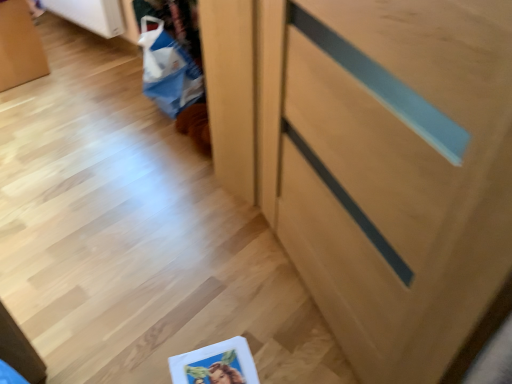
Question: Is light wood cabinet at center at the right side of blue paper bag at lower left?

Choices:
 (A) no
 (B) yes

Answer: (B)

Question: Does light wood cabinet at center have a lesser height compared to blue paper bag at lower left?

Choices:
 (A) yes
 (B) no

Answer: (B)

Question: Can you confirm if light wood cabinet at center is thinner than blue paper bag at lower left?

Choices:
 (A) no
 (B) yes

Answer: (B)

Question: From a real-world perspective, does light wood cabinet at center sit lower than blue paper bag at lower left?

Choices:
 (A) yes
 (B) no

Answer: (B)

Question: Does light wood cabinet at center have a larger size compared to blue paper bag at lower left?

Choices:
 (A) yes
 (B) no

Answer: (A)

Question: Considering the relative positions of light wood cabinet at center and blue paper bag at lower left in the image provided, is light wood cabinet at center in front of blue paper bag at lower left?

Choices:
 (A) no
 (B) yes

Answer: (B)

Question: Can you confirm if blue paper bag at lower left is positioned to the left of light wood cabinet at center?

Choices:
 (A) yes
 (B) no

Answer: (A)

Question: Considering the relative sizes of blue paper bag at lower left and light wood cabinet at center in the image provided, is blue paper bag at lower left wider than light wood cabinet at center?

Choices:
 (A) yes
 (B) no

Answer: (A)

Question: Could you tell me if blue paper bag at lower left is turned towards light wood cabinet at center?

Choices:
 (A) yes
 (B) no

Answer: (B)

Question: Does blue paper bag at lower left have a lesser width compared to light wood cabinet at center?

Choices:
 (A) yes
 (B) no

Answer: (B)

Question: Does blue paper bag at lower left come behind light wood cabinet at center?

Choices:
 (A) no
 (B) yes

Answer: (B)

Question: From a real-world perspective, is blue paper bag at lower left positioned under light wood cabinet at center based on gravity?

Choices:
 (A) yes
 (B) no

Answer: (A)

Question: Is blue paper bag at lower left spatially inside light wood cabinet at center, or outside of it?

Choices:
 (A) outside
 (B) inside

Answer: (A)